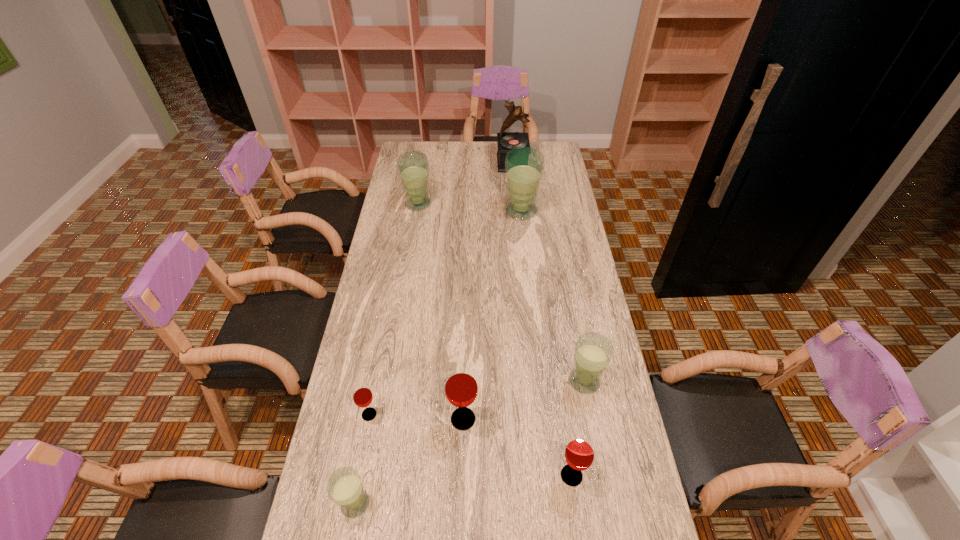
This screenshot has width=960, height=540. I want to click on the farthest object, so (x=506, y=141).

Where is `the third blue glass from left to right`? Image resolution: width=960 pixels, height=540 pixels. the third blue glass from left to right is located at coordinates (524, 166).

Find the location of a particular element. the tallest glass is located at coordinates (524, 166).

Locate an element on the screen. The image size is (960, 540). the second biggest blue glass is located at coordinates (413, 167).

Find the location of a particular element. the fifth object from right to left is located at coordinates (461, 387).

Find the location of `the biggest red glass`. the biggest red glass is located at coordinates (461, 387).

At what (x,y) coordinates should I click in order to perform the action: click on the nearest red glass. Please return your answer as a coordinate pair (x, y). This screenshot has width=960, height=540. Looking at the image, I should click on (579, 454).

Where is `the second biggest red glass`? the second biggest red glass is located at coordinates (579, 454).

Locate an element on the screen. The height and width of the screenshot is (540, 960). the rightmost blue glass is located at coordinates (593, 351).

Where is `the fourth farthest object`? the fourth farthest object is located at coordinates pyautogui.click(x=593, y=351).